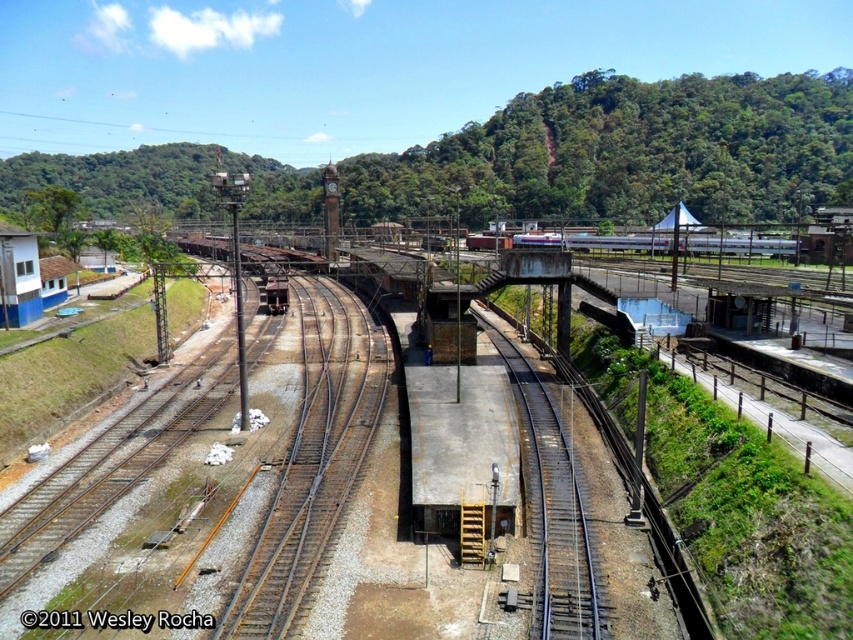
Does green leafy hillside at upper center have a lesser width compared to silver metallic train at center?

A: No, green leafy hillside at upper center is not thinner than silver metallic train at center.

From the picture: Is green leafy hillside at upper center to the left of silver metallic train at center from the viewer's perspective?

Correct, you'll find green leafy hillside at upper center to the left of silver metallic train at center.

Which is in front, point (732, 192) or point (662, 237)?

Point (662, 237)

Locate an element on the screen. This screenshot has width=853, height=640. green leafy hillside at upper center is located at coordinates (631, 150).

Does green leafy hillside at upper center have a larger size compared to smooth steel tracks at center?

Indeed, green leafy hillside at upper center has a larger size compared to smooth steel tracks at center.

Based on the photo, can you confirm if green leafy hillside at upper center is taller than smooth steel tracks at center?

Yes.

Where is `green leafy hillside at upper center`? Image resolution: width=853 pixels, height=640 pixels. green leafy hillside at upper center is located at coordinates (631, 150).

At what (x,y) coordinates should I click in order to perform the action: click on green leafy hillside at upper center. Please return your answer as a coordinate pair (x, y). The width and height of the screenshot is (853, 640). Looking at the image, I should click on tap(631, 150).

Is smooth steel tracks at center shorter than silver metallic train at center?

Correct, smooth steel tracks at center is not as tall as silver metallic train at center.

Between smooth steel tracks at center and silver metallic train at center, which one is positioned lower?

smooth steel tracks at center is below.

This screenshot has width=853, height=640. What do you see at coordinates (553, 513) in the screenshot?
I see `smooth steel tracks at center` at bounding box center [553, 513].

Find the location of a particular element. Image resolution: width=853 pixels, height=640 pixels. smooth steel tracks at center is located at coordinates (553, 513).